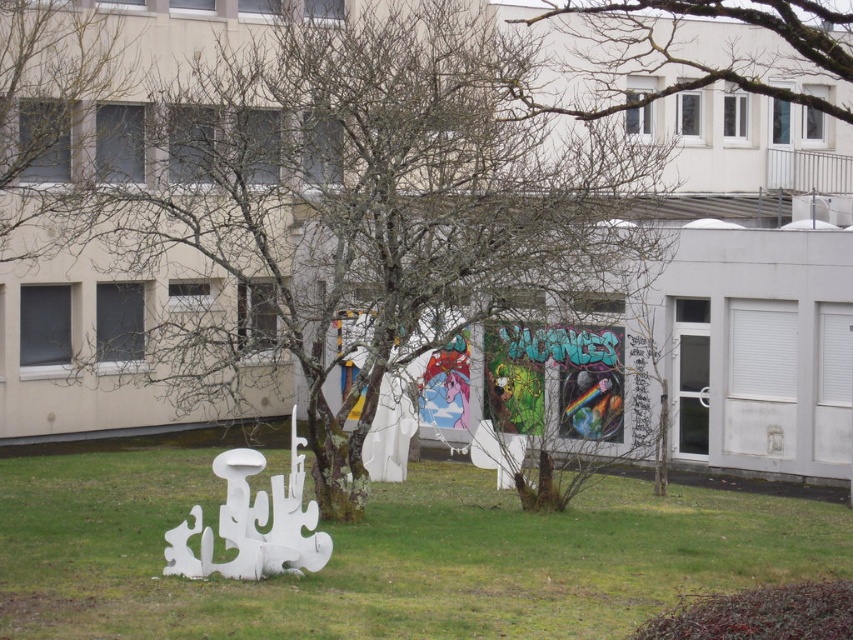
You are standing in front of the modern building and want to walk towards the green grass at lower center. Which direction should you walk relative to the bare branches at upper center?

You should walk to the left of the bare branches at upper center because the green grass at lower center is located to the left of them.

You are standing in front of the modern building with beige facade and looking towards the grassy area. There is a point at coordinates (387, 556). What is located at this point?

The point at coordinates (387, 556) corresponds to green grass at lower center.

You are standing in the outdoor area in front of the building. You see the bare branches at center and the green grass at lower center. Which object is positioned more to the left from your perspective?

The bare branches at center are positioned to the left of the green grass at lower center, so they are more to the left.